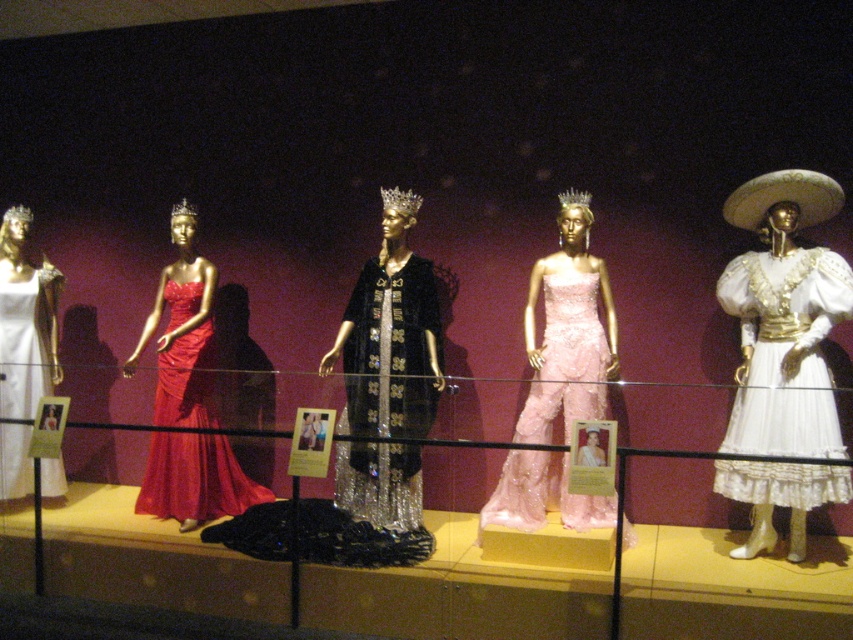
You are standing in front of the display of mannequins. There are two points marked on the image at coordinates point (558,285) and point (268,497). Which point is closer to your viewpoint?

Point (558,285) is closer to the camera than point (268,497).

You are a fashion designer who needs to place a 24 inch wide accessory between the white lace dress at right and the pink satin jumpsuit at center. Can you fit it there?

The distance between the white lace dress at right and the pink satin jumpsuit at center is 26.13 inches. Since the accessory is 24 inches wide, it can fit as there is enough space.

You are a fashion designer observing the display of mannequins. You notice the white lace dress at right and the shiny black fabric dress at center. Which dress is placed lower on the mannequin?

The white lace dress at right is positioned under the shiny black fabric dress at center, so the white lace dress at right is placed lower on the mannequin.